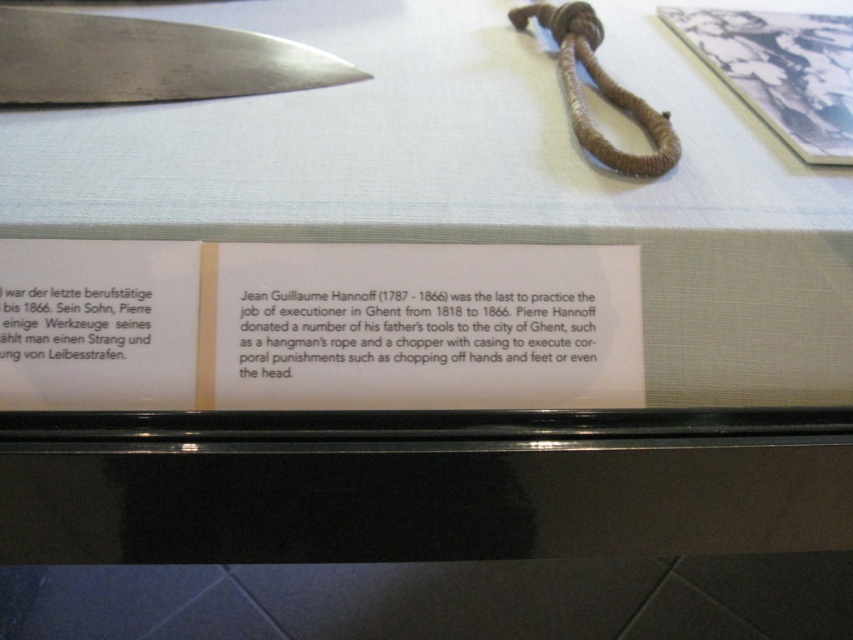
You are a museum visitor looking at the display case. You see a polished metal knife at upper left and a black paper at lower left. Which object is closer to the top of the display case?

The polished metal knife at upper left is closer to the top of the display case because it is positioned above the black paper at lower left.

You are a museum visitor who wants to know if the polished metal knife at upper left can fit into a storage box designed to accommodate items up to the height of the brown woven rope at upper center. Based on the display case description, will the knife fit?

The polished metal knife at upper left is not as tall as the brown woven rope at upper center, so it will fit into the storage box designed for the rope height.

You are a museum visitor who wants to read the label but can only see the black paper at center and brown woven rope at upper center. Which object is closer to the bottom of the display case?

A: The black paper at center is closer to the bottom of the display case because it is shorter than the brown woven rope at upper center.